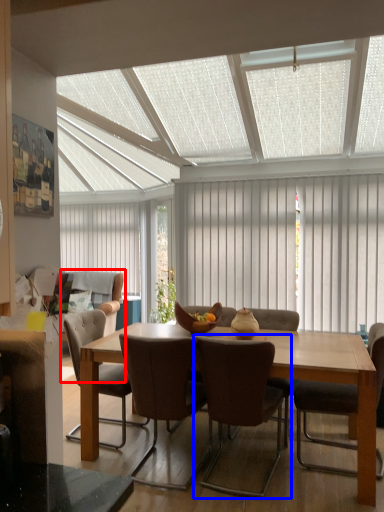
Question: Which object is closer to the camera taking this photo, couch (highlighted by a red box) or chair (highlighted by a blue box)?

Choices:
 (A) couch
 (B) chair

Answer: (B)